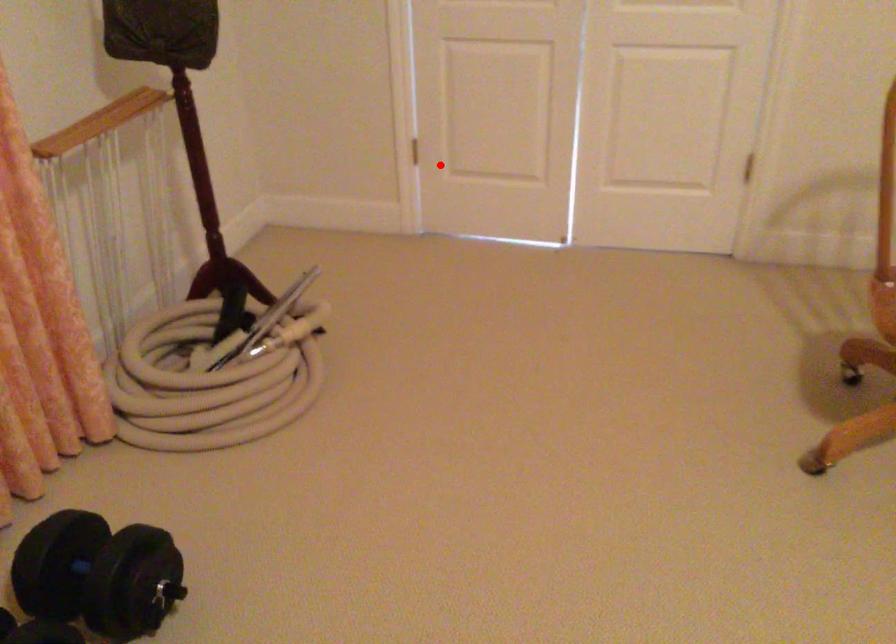
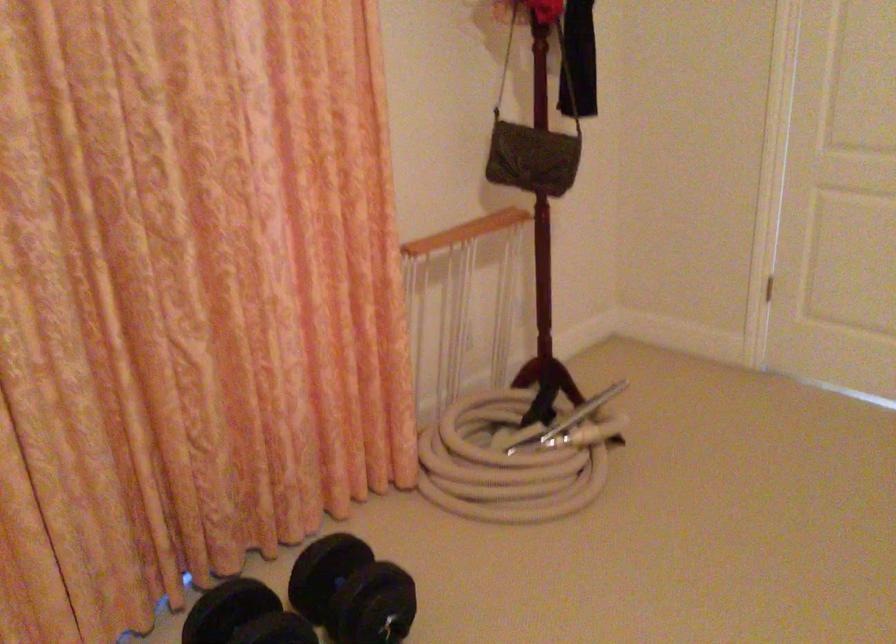
Where in the second image is the point corresponding to the highlighted location from the first image?

(762, 283)